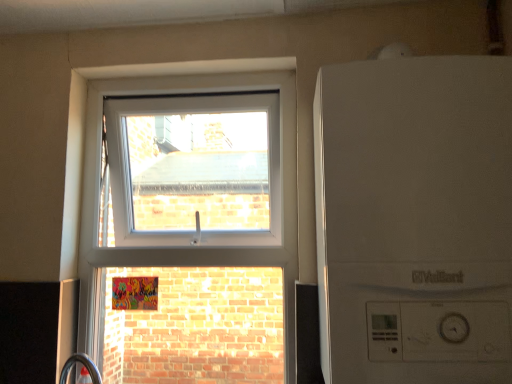
What do you see at coordinates (192, 226) in the screenshot? I see `transparent glass window at upper center` at bounding box center [192, 226].

Identify the location of transparent glass window at upper center. (192, 226).

Locate an element on the screen. white matte boiler at upper center is located at coordinates (415, 220).

The height and width of the screenshot is (384, 512). What do you see at coordinates (415, 220) in the screenshot?
I see `white matte boiler at upper center` at bounding box center [415, 220].

Where is `transparent glass window at upper center`? transparent glass window at upper center is located at coordinates (192, 226).

Which object is positioned more to the left, white matte boiler at upper center or transparent glass window at upper center?

transparent glass window at upper center.

Does white matte boiler at upper center lie behind transparent glass window at upper center?

No, white matte boiler at upper center is closer to the camera.

Considering the points (461, 362) and (181, 234), which point is behind, point (461, 362) or point (181, 234)?

Positioned behind is point (181, 234).

From the image's perspective, between white matte boiler at upper center and transparent glass window at upper center, who is located below?

transparent glass window at upper center is shown below in the image.

From a real-world perspective, is white matte boiler at upper center on transparent glass window at upper center?

Yes, from a real-world perspective, white matte boiler at upper center is on top of transparent glass window at upper center.

Between white matte boiler at upper center and transparent glass window at upper center, which one has larger width?

Wider between the two is white matte boiler at upper center.

Considering the sizes of objects white matte boiler at upper center and transparent glass window at upper center in the image provided, who is taller, white matte boiler at upper center or transparent glass window at upper center?

With more height is transparent glass window at upper center.

Considering the relative sizes of white matte boiler at upper center and transparent glass window at upper center in the image provided, is white matte boiler at upper center bigger than transparent glass window at upper center?

No.

Is white matte boiler at upper center not inside transparent glass window at upper center?

Absolutely, white matte boiler at upper center is external to transparent glass window at upper center.

Is white matte boiler at upper center next to transparent glass window at upper center?

No, white matte boiler at upper center is not beside transparent glass window at upper center.

Is white matte boiler at upper center facing away from transparent glass window at upper center?

No, white matte boiler at upper center's orientation is not away from transparent glass window at upper center.

How far apart are white matte boiler at upper center and transparent glass window at upper center?

white matte boiler at upper center is 23.31 inches from transparent glass window at upper center.

This screenshot has height=384, width=512. Find the location of `window that appears below the white matte boiler at upper center (from a real-world perspective)`. window that appears below the white matte boiler at upper center (from a real-world perspective) is located at coordinates [192, 226].

Consider the image. Which is more to the right, transparent glass window at upper center or white matte boiler at upper center?

white matte boiler at upper center is more to the right.

Between transparent glass window at upper center and white matte boiler at upper center, which one is positioned behind?

transparent glass window at upper center is more distant.

Does point (122, 331) appear closer or farther from the camera than point (362, 295)?

Point (122, 331) is positioned farther from the camera compared to point (362, 295).

From the image's perspective, relative to white matte boiler at upper center, is transparent glass window at upper center above or below?

transparent glass window at upper center is below white matte boiler at upper center.

From a real-world perspective, who is located higher, transparent glass window at upper center or white matte boiler at upper center?

white matte boiler at upper center, from a real-world perspective.

Looking at this image, which object is wider, transparent glass window at upper center or white matte boiler at upper center?

white matte boiler at upper center.

Can you confirm if transparent glass window at upper center is taller than white matte boiler at upper center?

Yes.

Can you confirm if transparent glass window at upper center is smaller than white matte boiler at upper center?

No, transparent glass window at upper center is not smaller than white matte boiler at upper center.

Would you say transparent glass window at upper center is inside or outside white matte boiler at upper center?

transparent glass window at upper center exists outside the volume of white matte boiler at upper center.

Is transparent glass window at upper center far from white matte boiler at upper center?

No, transparent glass window at upper center is not far away from white matte boiler at upper center.

Is transparent glass window at upper center oriented towards white matte boiler at upper center?

No, transparent glass window at upper center is not oriented towards white matte boiler at upper center.

How different are the orientations of transparent glass window at upper center and white matte boiler at upper center in degrees?

The angle between the facing direction of transparent glass window at upper center and the facing direction of white matte boiler at upper center is 0.000488 degrees.

Based on the photo, measure the distance from transparent glass window at upper center to white matte boiler at upper center.

The distance of transparent glass window at upper center from white matte boiler at upper center is 23.31 inches.

I want to click on washing machine that is in front of the transparent glass window at upper center, so click(415, 220).

Find the location of a particular element. window on the left of white matte boiler at upper center is located at coordinates (192, 226).

Identify the location of window behind the white matte boiler at upper center. (192, 226).